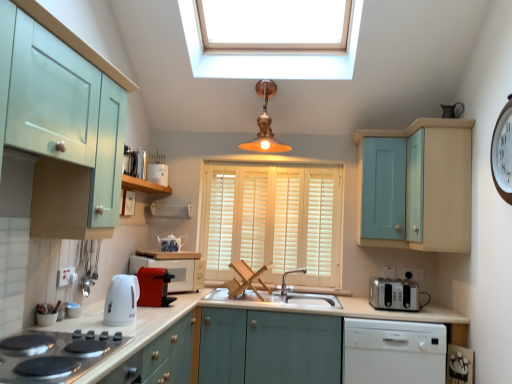
Where is `vacant area on top of white wood blinds at center (from a real-world perspective)`? This screenshot has width=512, height=384. vacant area on top of white wood blinds at center (from a real-world perspective) is located at coordinates (270, 163).